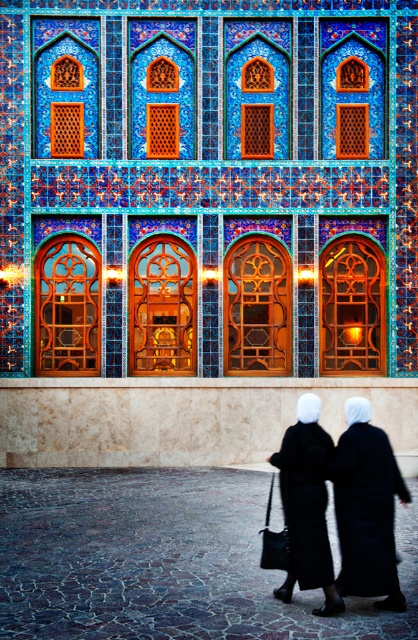
You are an architect analyzing the facade of a historical building. You notice the blue mosaic tiles at center and the black matte hijab at center. Based on their positions, which object appears taller in the image?

The blue mosaic tiles at center appears taller than the black matte hijab at center as stated in the objects description.